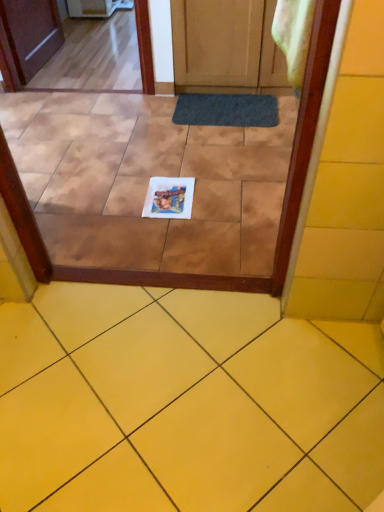
Measure the distance between white paper at center and camera.

white paper at center and camera are 82.56 centimeters apart from each other.

Identify the location of white paper at center. This screenshot has width=384, height=512. (288, 172).

This screenshot has width=384, height=512. I want to click on yellow matte tile at lower center, so click(x=185, y=404).

You are a GUI agent. You are given a task and a screenshot of the screen. Output one action in this format:
    pyautogui.click(x=<x>, y=<y>)
    Task: Click on the copy directly beneath the white paper at center (from a real-world perspective)
    
    Given the screenshot: What is the action you would take?
    pyautogui.click(x=169, y=198)

Consider the image. Is white glossy coaster at center in contact with white paper at center?

A: white glossy coaster at center and white paper at center are not in contact.

Is white glossy coaster at center to the left or to the right of white paper at center in the image?

In the image, white glossy coaster at center appears on the right side of white paper at center.

Does white glossy coaster at center have a lesser width compared to white paper at center?

Yes, white glossy coaster at center is thinner than white paper at center.

Does white paper at center lie in front of dark gray rubber doormat at center?

Yes, white paper at center is closer to the viewer.

From the picture: How different are the orientations of white paper at center and dark gray rubber doormat at center in degrees?

They differ by 180 degrees in their facing directions.

Is point (330, 54) less distant than point (198, 114)?

Yes, it is in front of point (198, 114).

From the image's perspective, which one is positioned lower, white paper at center or dark gray rubber doormat at center?

From the image's view, white paper at center is below.

Where is `glass door behind the yellow matte tile at lower center`? Image resolution: width=384 pixels, height=512 pixels. glass door behind the yellow matte tile at lower center is located at coordinates (288, 172).

Is yellow matte tile at lower center positioned beyond the bounds of white paper at center?

Indeed, yellow matte tile at lower center is completely outside white paper at center.

In the scene shown: Considering the relative sizes of yellow matte tile at lower center and white paper at center in the image provided, is yellow matte tile at lower center taller than white paper at center?

Yes.

From a real-world perspective, is yellow matte tile at lower center located higher than white paper at center?

Yes, from a real-world perspective, yellow matte tile at lower center is over white paper at center

Considering the relative positions of white paper at center and yellow matte tile at lower center in the image provided, is white paper at center to the right of yellow matte tile at lower center from the viewer's perspective?

No, white paper at center is not to the right of yellow matte tile at lower center.

In the image, is white paper at center positioned in front of or behind yellow matte tile at lower center?

Visually, white paper at center is located behind yellow matte tile at lower center.

Based on the photo, is white paper at center thinner than yellow matte tile at lower center?

No.

From a real-world perspective, is white paper at center located beneath yellow matte tile at lower center?

Correct, in the physical world, white paper at center is lower than yellow matte tile at lower center.

How far apart are white paper at center and white glossy coaster at center?

The distance of white paper at center from white glossy coaster at center is 19.76 inches.

Consider the image. From the image's perspective, is white paper at center located beneath white glossy coaster at center?

No, from the image's perspective, white paper at center is not below white glossy coaster at center.

Is white paper at center touching white glossy coaster at center?

No, white paper at center is not touching white glossy coaster at center.

Considering the sizes of white paper at center and white glossy coaster at center in the image, is white paper at center bigger or smaller than white glossy coaster at center?

In the image, white paper at center appears to be larger than white glossy coaster at center.

Is yellow matte tile at lower center shorter than white glossy coaster at center?

No.

Who is bigger, yellow matte tile at lower center or white glossy coaster at center?

Bigger between the two is yellow matte tile at lower center.

Is yellow matte tile at lower center turned away from white glossy coaster at center?

yellow matte tile at lower center does not have its back to white glossy coaster at center.

Is yellow matte tile at lower center placed right next to white glossy coaster at center?

No, yellow matte tile at lower center is not touching white glossy coaster at center.

Which of these two, dark gray rubber doormat at center or yellow matte tile at lower center, is smaller?

With smaller size is dark gray rubber doormat at center.

Would you say yellow matte tile at lower center is part of dark gray rubber doormat at center's contents?

Definitely not — yellow matte tile at lower center is not inside dark gray rubber doormat at center.

Is dark gray rubber doormat at center next to yellow matte tile at lower center and touching it?

dark gray rubber doormat at center and yellow matte tile at lower center are clearly separated.

Is dark gray rubber doormat at center in front of yellow matte tile at lower center?

No, it is behind yellow matte tile at lower center.

At what (x,y) coordinates should I click in order to perform the action: click on glass door in front of the white glossy coaster at center. Please return your answer as a coordinate pair (x, y). This screenshot has width=384, height=512. Looking at the image, I should click on (288, 172).

Identify the location of glass door below the dark gray rubber doormat at center (from a real-world perspective). This screenshot has height=512, width=384. point(288,172).

Estimate the real-world distances between objects in this image. Which object is closer to dark gray rubber doormat at center, white paper at center or yellow matte tile at lower center?

The object closer to dark gray rubber doormat at center is white paper at center.

When comparing their distances from white paper at center, does white glossy coaster at center or dark gray rubber doormat at center seem closer?

The object closer to white paper at center is white glossy coaster at center.

From the image, which object appears to be farther from yellow matte tile at lower center, white paper at center or white glossy coaster at center?

Among the two, white glossy coaster at center is located further to yellow matte tile at lower center.

When comparing their distances from dark gray rubber doormat at center, does white paper at center or white glossy coaster at center seem closer?

The object closer to dark gray rubber doormat at center is white glossy coaster at center.

Considering their positions, is dark gray rubber doormat at center positioned closer to white paper at center than yellow matte tile at lower center?

yellow matte tile at lower center is positioned closer to the anchor white paper at center.

Which object lies nearer to the anchor point dark gray rubber doormat at center, white glossy coaster at center or white paper at center?

white glossy coaster at center is closer to dark gray rubber doormat at center.

When comparing their distances from white glossy coaster at center, does white paper at center or dark gray rubber doormat at center seem closer?

Based on the image, white paper at center appears to be nearer to white glossy coaster at center.

Estimate the real-world distances between objects in this image. Which object is further from white paper at center, dark gray rubber doormat at center or white glossy coaster at center?

Based on the image, dark gray rubber doormat at center appears to be further to white paper at center.

This screenshot has height=512, width=384. I want to click on glass door located between yellow matte tile at lower center and white glossy coaster at center in the depth direction, so click(x=288, y=172).

I want to click on copy between yellow matte tile at lower center and dark gray rubber doormat at center in the front-back direction, so click(169, 198).

In order to click on copy between white paper at center and dark gray rubber doormat at center in the front-back direction in this screenshot , I will do `click(169, 198)`.

This screenshot has width=384, height=512. In order to click on glass door between yellow matte tile at lower center and dark gray rubber doormat at center from front to back in this screenshot , I will do `click(288, 172)`.